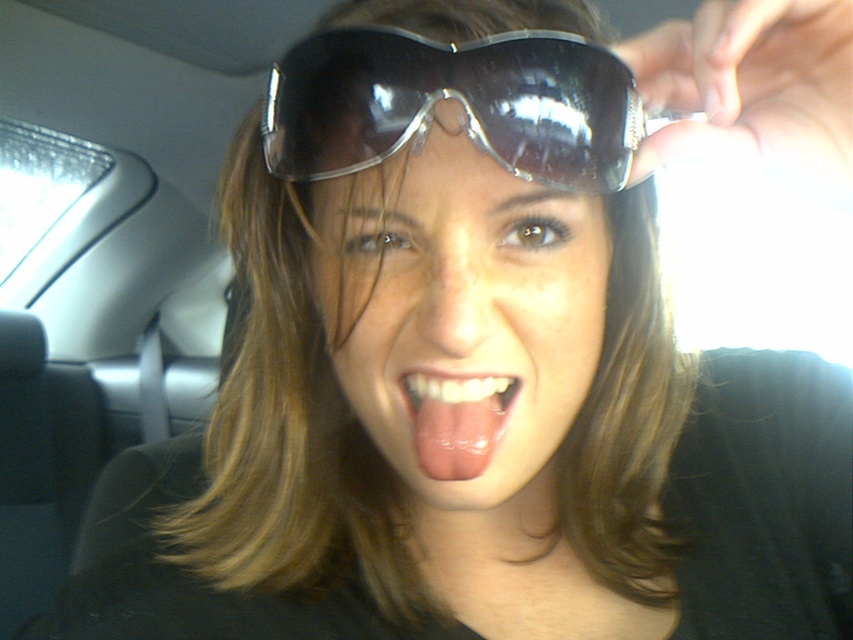
Between glossy plastic sunglasses at center and pink glossy tongue at center, which one is positioned lower?

pink glossy tongue at center is lower down.

Find the location of a particular element. The image size is (853, 640). glossy plastic sunglasses at center is located at coordinates (459, 314).

What do you see at coordinates (459, 314) in the screenshot? I see `glossy plastic sunglasses at center` at bounding box center [459, 314].

In the scene shown: Does glossy plastic sunglasses at center have a larger size compared to shiny black goggles at center?

Yes, glossy plastic sunglasses at center is bigger than shiny black goggles at center.

Identify the location of glossy plastic sunglasses at center. This screenshot has width=853, height=640. (459, 314).

You are a GUI agent. You are given a task and a screenshot of the screen. Output one action in this format:
    pyautogui.click(x=<x>, y=<y>)
    Task: Click on the glossy plastic sunglasses at center
    The height and width of the screenshot is (640, 853).
    Given the screenshot: What is the action you would take?
    pyautogui.click(x=459, y=314)

Can you confirm if shiny black goggles at center is taller than pink glossy tongue at center?

Correct, shiny black goggles at center is much taller as pink glossy tongue at center.

Is shiny black goggles at center positioned before pink glossy tongue at center?

That is True.

Which is behind, point (296, 115) or point (447, 394)?

Positioned behind is point (296, 115).

Locate an element on the screen. shiny black goggles at center is located at coordinates (457, 104).